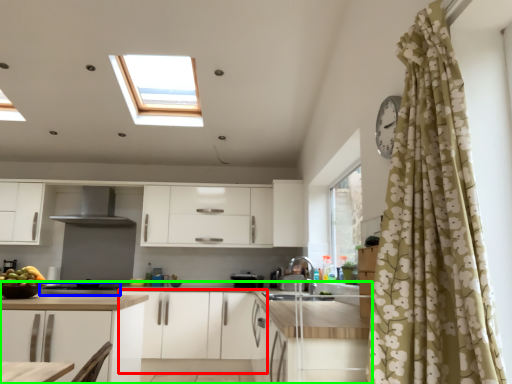
Question: Which object is the closest to the cabinetry (highlighted by a red box)? Choose among these: appliance (highlighted by a blue box) or countertop (highlighted by a green box).

Choices:
 (A) appliance
 (B) countertop

Answer: (B)